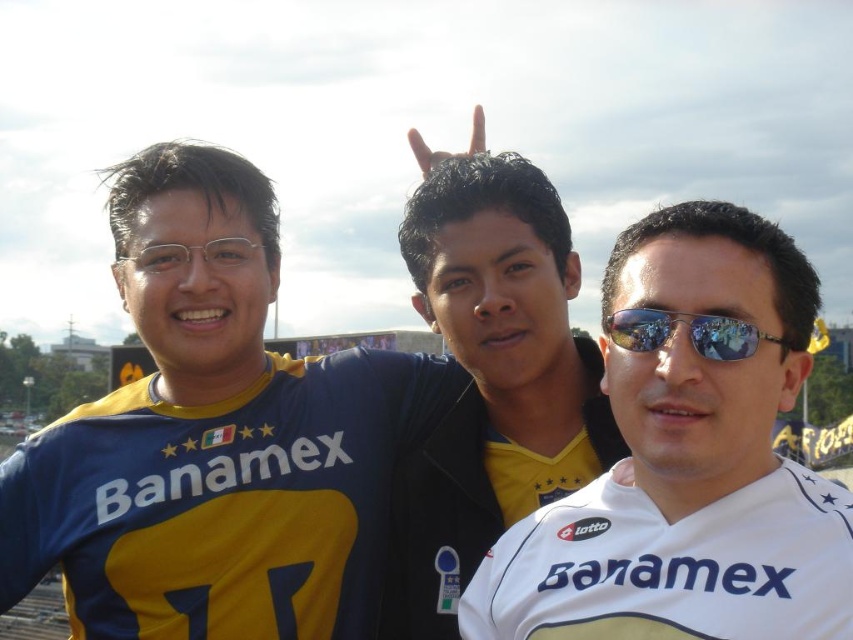
Between white matte jersey at center and sunglasses at center, which one is positioned lower?

white matte jersey at center

Locate an element on the screen. This screenshot has height=640, width=853. white matte jersey at center is located at coordinates (688, 460).

You are a GUI agent. You are given a task and a screenshot of the screen. Output one action in this format:
    pyautogui.click(x=<x>, y=<y>)
    Task: Click on the white matte jersey at center
    
    Given the screenshot: What is the action you would take?
    pyautogui.click(x=688, y=460)

Describe the element at coordinates (245, 452) in the screenshot. The width and height of the screenshot is (853, 640). I see `blue jersey at left` at that location.

Which is more to the right, blue jersey at left or white matte jersey at center?

white matte jersey at center is more to the right.

Which is in front, point (91, 582) or point (564, 614)?

Point (564, 614) is more forward.

The width and height of the screenshot is (853, 640). I want to click on blue jersey at left, so click(245, 452).

Is white matte jersey at center positioned before yellow jersey at center?

That is True.

Which is more to the left, white matte jersey at center or yellow jersey at center?

yellow jersey at center

The width and height of the screenshot is (853, 640). Describe the element at coordinates (688, 460) in the screenshot. I see `white matte jersey at center` at that location.

Where is `white matte jersey at center`? white matte jersey at center is located at coordinates (688, 460).